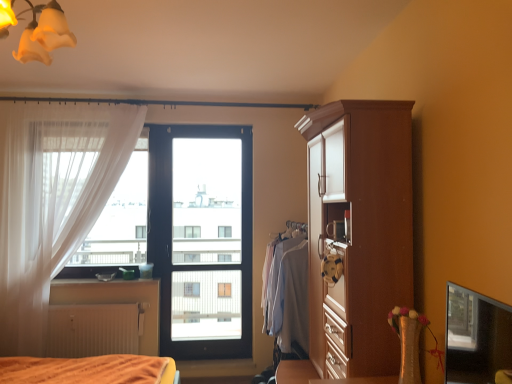
Identify the location of vacant space situated above white matte radiator at lower left (from a real-world perspective). (91, 301).